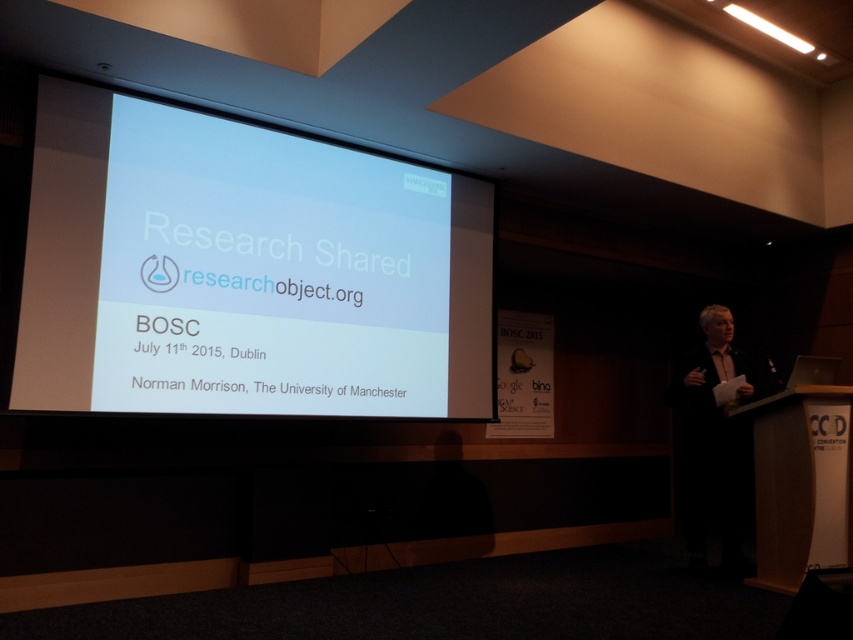
Is white glossy projection screen at upper left wider than light brown leather jacket at right?

Correct, the width of white glossy projection screen at upper left exceeds that of light brown leather jacket at right.

Can you confirm if white glossy projection screen at upper left is positioned below light brown leather jacket at right?

Actually, white glossy projection screen at upper left is above light brown leather jacket at right.

Where is `white glossy projection screen at upper left`? The image size is (853, 640). white glossy projection screen at upper left is located at coordinates (244, 269).

Locate an element on the screen. Image resolution: width=853 pixels, height=640 pixels. white glossy projection screen at upper left is located at coordinates (244, 269).